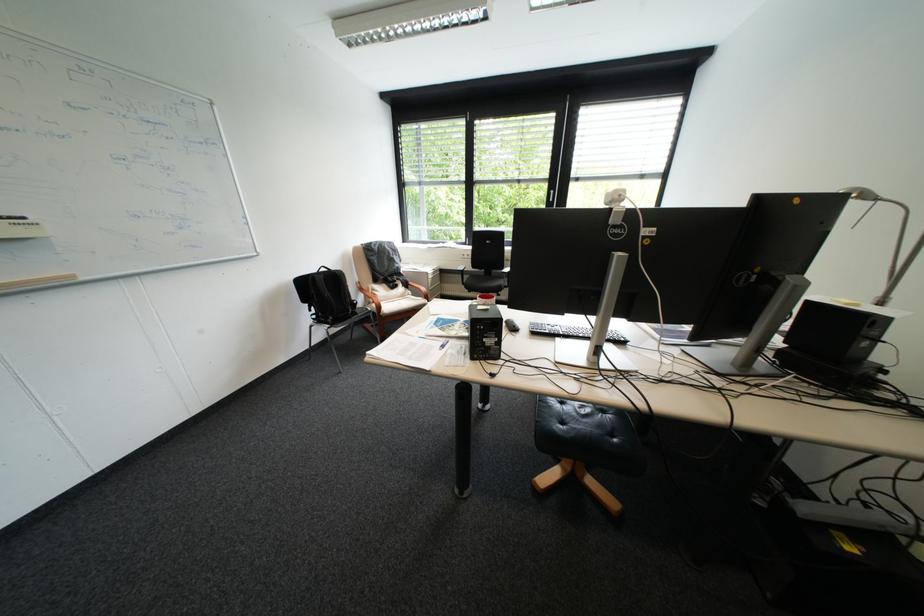
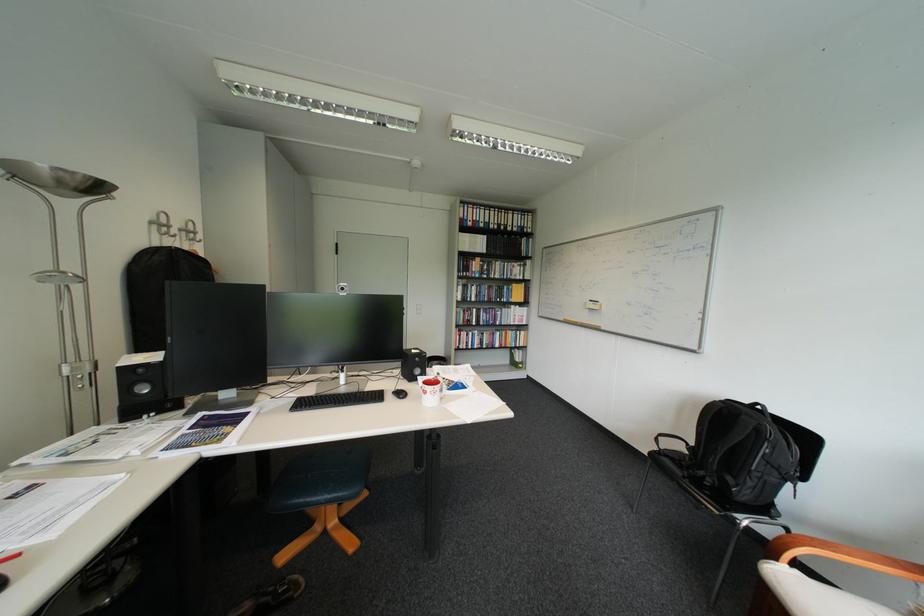
The point at (347, 273) is marked in the first image. Where is the corresponding point in the second image?

(756, 418)